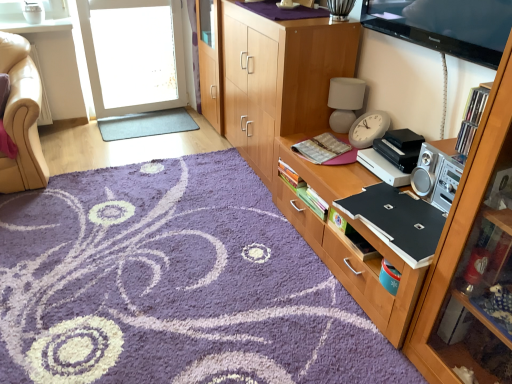
The width and height of the screenshot is (512, 384). Find the location of `free spot below black matte laptop at right (from a real-world perspective)`. free spot below black matte laptop at right (from a real-world perspective) is located at coordinates (376, 209).